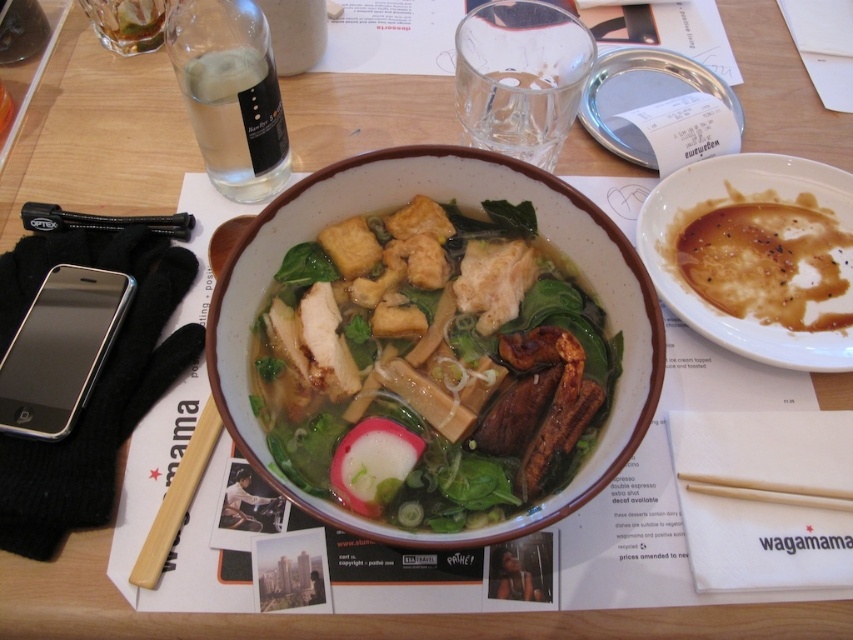
Question: Is white creamy soup at upper right behind wooden chopstick at center?

Choices:
 (A) yes
 (B) no

Answer: (A)

Question: Which point appears closest to the camera in this image?

Choices:
 (A) (21, 396)
 (B) (744, 250)
 (C) (548, 467)

Answer: (C)

Question: Among these objects, which one is farthest from the camera?

Choices:
 (A) white creamy soup at upper right
 (B) translucent broth with mixed vegetables and tofu at center
 (C) wooden chopstick at center

Answer: (A)

Question: Is translucent broth with mixed vegetables and tofu at center closer to camera compared to white creamy soup at upper right?

Choices:
 (A) yes
 (B) no

Answer: (A)

Question: Which object is closer to the camera taking this photo?

Choices:
 (A) translucent broth with mixed vegetables and tofu at center
 (B) silver metallic smartphone at lower left
 (C) wooden chopstick at center
 (D) white creamy soup at upper right

Answer: (A)

Question: From the image, what is the correct spatial relationship of silver metallic smartphone at lower left in relation to wooden chopstick at center?

Choices:
 (A) above
 (B) below

Answer: (A)